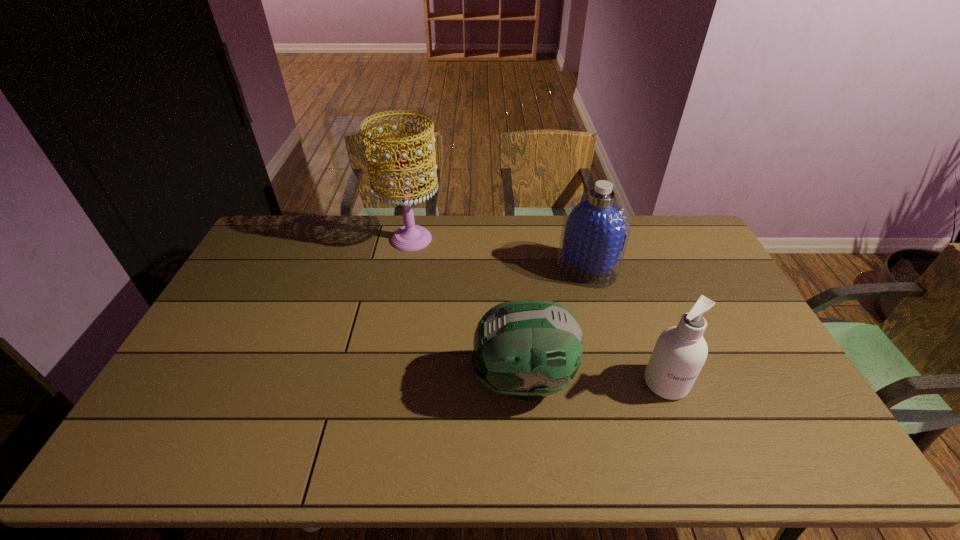
Image resolution: width=960 pixels, height=540 pixels. I want to click on the leftmost object, so click(x=410, y=237).

I want to click on lampshade, so click(x=410, y=237).

The height and width of the screenshot is (540, 960). Find the location of `the farther cleansing agent`. the farther cleansing agent is located at coordinates (596, 227).

I want to click on the nearer cleansing agent, so click(x=680, y=352).

At what (x,y) coordinates should I click in order to perform the action: click on the third object from right to left. Please return your answer as a coordinate pair (x, y). This screenshot has width=960, height=540. Looking at the image, I should click on (528, 348).

Identify the location of free space located on the front of the leftmost object. (404, 278).

In order to click on free space located on the right of the farther cleansing agent in this screenshot , I will do `click(673, 269)`.

Find the location of a particular element. vacant space located 0.090m on the visor of the second object from left to right is located at coordinates (438, 381).

Identify the location of free spot located on the visor of the second object from left to right. Image resolution: width=960 pixels, height=540 pixels. (438, 381).

At what (x,y) coordinates should I click in order to perform the action: click on free spot located on the visor of the second object from left to right. Please return your answer as a coordinate pair (x, y). This screenshot has width=960, height=540. Looking at the image, I should click on (386, 381).